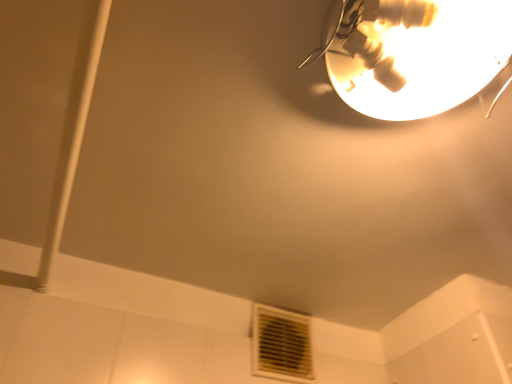
Question: In the image, is metallic gold lampshade at upper right on the left side or the right side of white plastic air conditioning at lower center?

Choices:
 (A) left
 (B) right

Answer: (B)

Question: In terms of width, does metallic gold lampshade at upper right look wider or thinner when compared to white plastic air conditioning at lower center?

Choices:
 (A) thin
 (B) wide

Answer: (B)

Question: Is point (437, 44) closer or farther from the camera than point (262, 364)?

Choices:
 (A) farther
 (B) closer

Answer: (B)

Question: Considering the positions of white plastic air conditioning at lower center and metallic gold lampshade at upper right in the image, is white plastic air conditioning at lower center wider or thinner than metallic gold lampshade at upper right?

Choices:
 (A) wide
 (B) thin

Answer: (B)

Question: Which is correct: white plastic air conditioning at lower center is inside metallic gold lampshade at upper right, or outside of it?

Choices:
 (A) outside
 (B) inside

Answer: (A)

Question: From a real-world perspective, is white plastic air conditioning at lower center positioned above or below metallic gold lampshade at upper right?

Choices:
 (A) below
 (B) above

Answer: (A)

Question: Considering the relative positions of white plastic air conditioning at lower center and metallic gold lampshade at upper right in the image provided, is white plastic air conditioning at lower center to the left or to the right of metallic gold lampshade at upper right?

Choices:
 (A) left
 (B) right

Answer: (A)